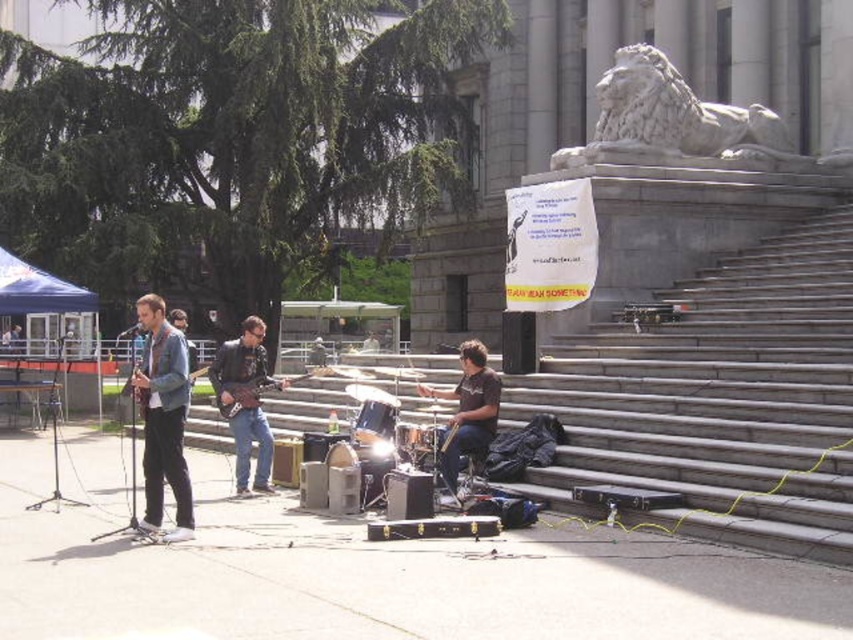
Question: Does wooden guitar at center come in front of wooden electric guitar at center?

Choices:
 (A) no
 (B) yes

Answer: (B)

Question: Which point appears closest to the camera in this image?

Choices:
 (A) (254, 380)
 (B) (468, 419)
 (C) (155, 298)

Answer: (C)

Question: Which of the following is the closest to the observer?

Choices:
 (A) dark brown leather drum set at center
 (B) denim jacket at left
 (C) wooden electric guitar at center
 (D) wooden guitar at center

Answer: (B)

Question: In this image, where is dark brown leather drum set at center located relative to wooden electric guitar at center?

Choices:
 (A) below
 (B) above

Answer: (B)

Question: Which object appears closest to the camera in this image?

Choices:
 (A) wooden electric guitar at center
 (B) wooden guitar at center

Answer: (B)

Question: Can you confirm if denim jacket at left is positioned above wooden guitar at center?

Choices:
 (A) no
 (B) yes

Answer: (A)